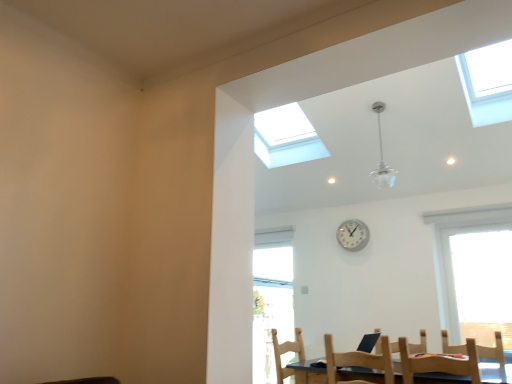
Question: Is clear glass chandelier at upper center in front of transparent glass window at upper right, the first window when ordered from right to left?

Choices:
 (A) no
 (B) yes

Answer: (A)

Question: Can you confirm if clear glass chandelier at upper center is bigger than transparent glass window at upper right, the second window from the back?

Choices:
 (A) no
 (B) yes

Answer: (A)

Question: Can you confirm if clear glass chandelier at upper center is thinner than transparent glass window at upper right, the first window positioned from the front?

Choices:
 (A) no
 (B) yes

Answer: (B)

Question: From a real-world perspective, is clear glass chandelier at upper center positioned under transparent glass window at upper right, the first window positioned from the front, based on gravity?

Choices:
 (A) no
 (B) yes

Answer: (B)

Question: From the image's perspective, is clear glass chandelier at upper center beneath transparent glass window at upper right, the first window when ordered from right to left?

Choices:
 (A) no
 (B) yes

Answer: (B)

Question: Choose the correct answer: Is clear glass chandelier at upper center inside light brown wooden chair at lower center, which is counted as the 1th chair, starting from the left, or outside it?

Choices:
 (A) outside
 (B) inside

Answer: (A)

Question: Relative to light brown wooden chair at lower center, marked as the third chair in a right-to-left arrangement, is clear glass chandelier at upper center in front or behind?

Choices:
 (A) behind
 (B) front

Answer: (A)

Question: Is point (377, 114) positioned closer to the camera than point (368, 367)?

Choices:
 (A) closer
 (B) farther

Answer: (B)

Question: From the image's perspective, is clear glass chandelier at upper center above or below light brown wooden chair at lower center, marked as the third chair in a right-to-left arrangement?

Choices:
 (A) below
 (B) above

Answer: (B)

Question: Is clear glass chandelier at upper center spatially inside white plastic clock at center, or outside of it?

Choices:
 (A) inside
 (B) outside

Answer: (B)

Question: From their relative heights in the image, would you say clear glass chandelier at upper center is taller or shorter than white plastic clock at center?

Choices:
 (A) short
 (B) tall

Answer: (B)

Question: Relative to white plastic clock at center, is clear glass chandelier at upper center in front or behind?

Choices:
 (A) behind
 (B) front

Answer: (B)

Question: Is clear glass chandelier at upper center bigger or smaller than white plastic clock at center?

Choices:
 (A) big
 (B) small

Answer: (A)

Question: Does point (382, 337) appear closer or farther from the camera than point (357, 231)?

Choices:
 (A) farther
 (B) closer

Answer: (B)

Question: Would you say light brown wooden chair at lower center, marked as the third chair in a right-to-left arrangement, is to the left or to the right of white plastic clock at center in the picture?

Choices:
 (A) right
 (B) left

Answer: (B)